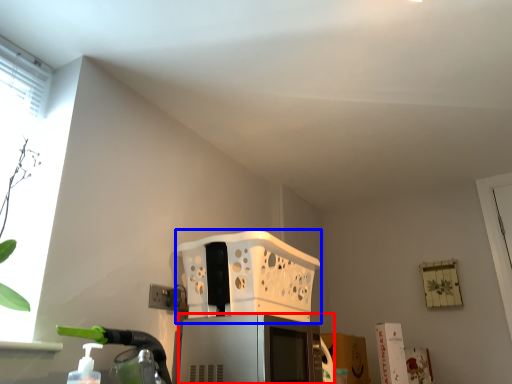
Question: Which object is closer to the camera taking this photo, appliance (highlighted by a red box) or basket (highlighted by a blue box)?

Choices:
 (A) appliance
 (B) basket

Answer: (A)